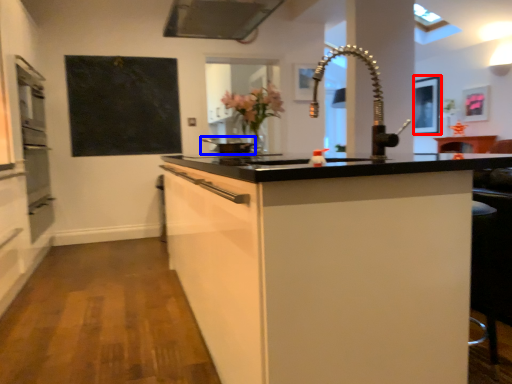
Question: Which object is further to the camera taking this photo, picture frame (highlighted by a red box) or appliance (highlighted by a blue box)?

Choices:
 (A) picture frame
 (B) appliance

Answer: (A)